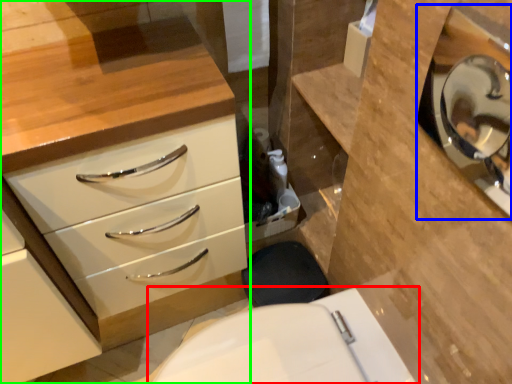
Question: Based on their relative distances, which object is nearer to toilet (highlighted by a red box)? Choose from medicine cabinet (highlighted by a blue box) and chest of drawers (highlighted by a green box).

Choices:
 (A) medicine cabinet
 (B) chest of drawers

Answer: (B)